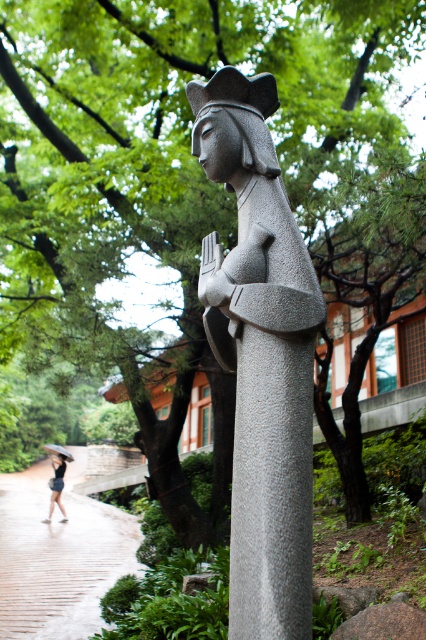
Who is positioned more to the left, granite statue at center or matte black dress at lower left?

matte black dress at lower left is more to the left.

How far apart are granite statue at center and matte black dress at lower left?

They are 29.83 feet apart.

This screenshot has width=426, height=640. Identify the location of granite statue at center. (261, 356).

This screenshot has height=640, width=426. In order to click on granite statue at center in this screenshot , I will do `click(261, 356)`.

Can you confirm if granite statue at center is positioned to the left of transparent plastic umbrella at lower left?

Incorrect, granite statue at center is not on the left side of transparent plastic umbrella at lower left.

Does point (253, 253) come behind point (65, 458)?

No, it is in front of (65, 458).

Where is `granite statue at center`? The width and height of the screenshot is (426, 640). granite statue at center is located at coordinates (261, 356).

At what (x,y) coordinates should I click in order to perform the action: click on granite statue at center. Please return your answer as a coordinate pair (x, y). The image size is (426, 640). Looking at the image, I should click on (261, 356).

Is brown brick path at lower left positioned before transparent plastic umbrella at lower left?

That is True.

Which is above, brown brick path at lower left or transparent plastic umbrella at lower left?

transparent plastic umbrella at lower left is above.

What do you see at coordinates (58, 554) in the screenshot? I see `brown brick path at lower left` at bounding box center [58, 554].

This screenshot has width=426, height=640. I want to click on brown brick path at lower left, so coord(58,554).